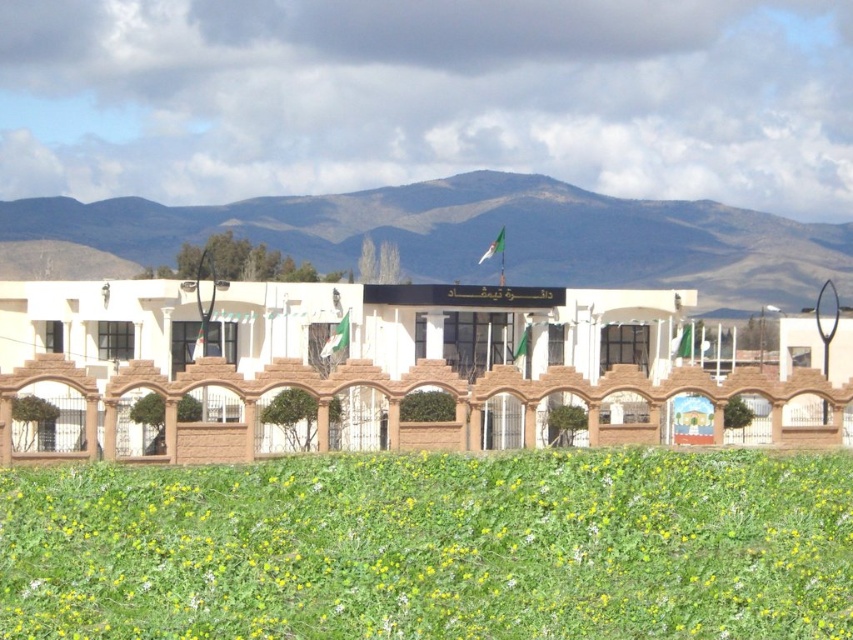
You are a gardener who needs to mow the green grass at lower center near the white brick building at center. Based on the height difference between them, can you estimate whether the grass is currently too short or just right for mowing?

The green grass at lower center has a lesser height compared to the white brick building at center, but since buildings are typically much taller than grass, this comparison doesn

You are a landscape architect designing a garden. You have a limited budget and need to decide which area between the green grass at lower center and the brown rocky mountain at upper center requires more soil. Based on their thickness, which area should you prioritize?

The green grass at lower center is thinner than the brown rocky mountain at upper center, so you should prioritize adding soil to the green grass at lower center to improve its thickness.

You are standing in front of the building and want to take a photo that includes both the building and the brown rocky mountain at upper center. Based on their positions, where should you position yourself relative to the building to capture both in the frame?

To capture both the building and the brown rocky mountain at upper center in your photo, you should position yourself at the lower left of the building since the brown rocky mountain at upper center is located at point (485,236).